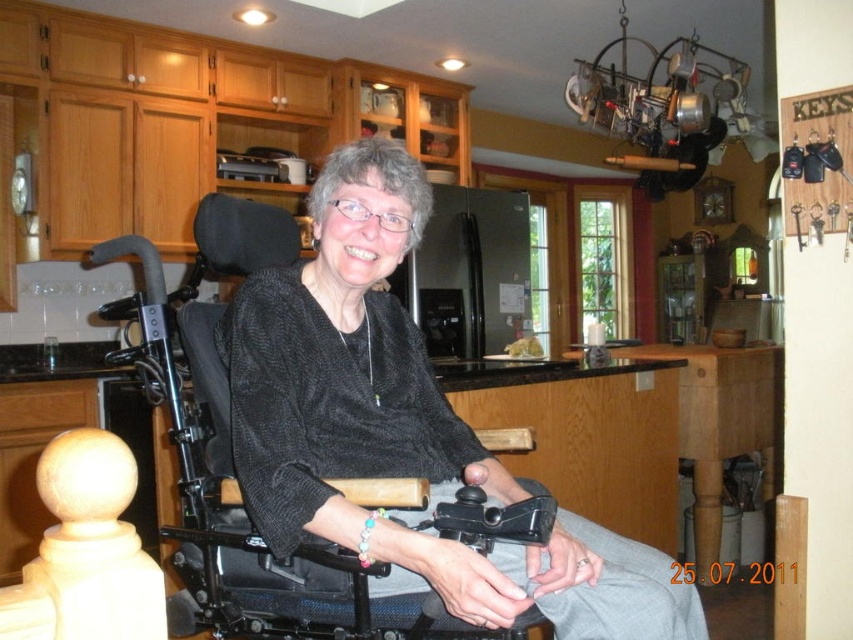
You are a delivery person entering the kitchen and need to place a package on the counter. There is a black mesh wheelchair at center and a black plastic video camera at lower center in your way. Which object should you move to access the counter?

You should move the black plastic video camera at lower center because the black mesh wheelchair at center is closer to you and cannot be moved easily, while the camera is further away and more accessible.

You are a delivery person who needs to bring a package to the kitchen. You see the black mesh wheelchair at center and the black plastic video camera at lower center. Which object is wider?

The black mesh wheelchair at center is wider than the black plastic video camera at lower center according to the description.